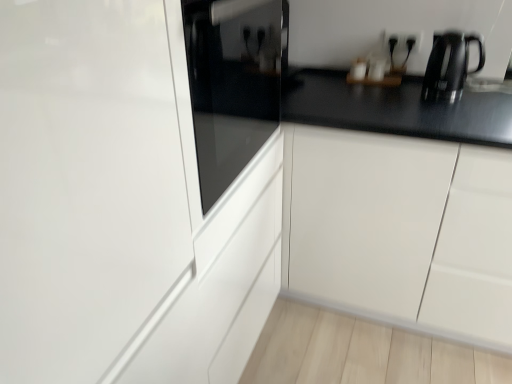
Question: Does glossy white glass door at center come behind glossy white cabinet at center?

Choices:
 (A) yes
 (B) no

Answer: (B)

Question: From a real-world perspective, is glossy white glass door at center below glossy white cabinet at center?

Choices:
 (A) no
 (B) yes

Answer: (A)

Question: Does glossy white glass door at center have a lesser height compared to glossy white cabinet at center?

Choices:
 (A) yes
 (B) no

Answer: (B)

Question: From the image's perspective, is glossy white glass door at center beneath glossy white cabinet at center?

Choices:
 (A) yes
 (B) no

Answer: (A)

Question: Could you tell me if glossy white glass door at center is turned towards glossy white cabinet at center?

Choices:
 (A) yes
 (B) no

Answer: (B)

Question: From a real-world perspective, is glossy white glass door at center physically above glossy white cabinet at center?

Choices:
 (A) no
 (B) yes

Answer: (B)

Question: Can you confirm if glossy white cabinet at center is thinner than black plastic electric outlet at upper right?

Choices:
 (A) yes
 (B) no

Answer: (B)

Question: Considering the relative positions of glossy white cabinet at center and black plastic electric outlet at upper right in the image provided, is glossy white cabinet at center behind black plastic electric outlet at upper right?

Choices:
 (A) yes
 (B) no

Answer: (B)

Question: From the image's perspective, is glossy white cabinet at center above black plastic electric outlet at upper right?

Choices:
 (A) yes
 (B) no

Answer: (B)

Question: Considering the relative sizes of glossy white cabinet at center and black plastic electric outlet at upper right in the image provided, is glossy white cabinet at center shorter than black plastic electric outlet at upper right?

Choices:
 (A) no
 (B) yes

Answer: (A)

Question: From a real-world perspective, is glossy white cabinet at center located beneath black plastic electric outlet at upper right?

Choices:
 (A) yes
 (B) no

Answer: (A)

Question: Could black plastic electric outlet at upper right be considered to be inside glossy white cabinet at center?

Choices:
 (A) no
 (B) yes

Answer: (A)

Question: Is glossy white glass door at center at the right side of black metallic kettle at upper right?

Choices:
 (A) yes
 (B) no

Answer: (B)